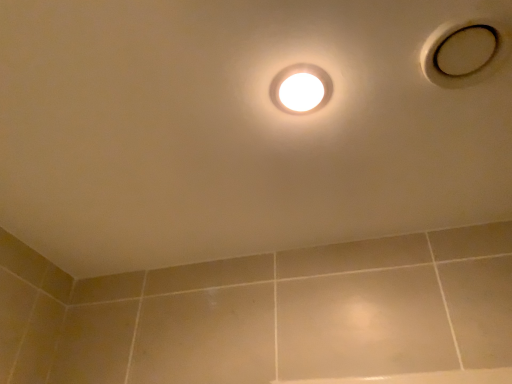
Question: Is white matte hole at upper right taller or shorter than white glossy droplight at center?

Choices:
 (A) short
 (B) tall

Answer: (B)

Question: In the image, is white matte hole at upper right positioned in front of or behind white glossy droplight at center?

Choices:
 (A) front
 (B) behind

Answer: (A)

Question: Considering the positions of white matte hole at upper right and white glossy droplight at center in the image, is white matte hole at upper right bigger or smaller than white glossy droplight at center?

Choices:
 (A) small
 (B) big

Answer: (B)

Question: Considering their positions, is white glossy droplight at center located in front of or behind white matte hole at upper right?

Choices:
 (A) front
 (B) behind

Answer: (B)

Question: Is white glossy droplight at center taller or shorter than white matte hole at upper right?

Choices:
 (A) tall
 (B) short

Answer: (B)

Question: From the image's perspective, is white glossy droplight at center positioned above or below white matte hole at upper right?

Choices:
 (A) above
 (B) below

Answer: (B)

Question: Is white glossy droplight at center wider or thinner than white matte hole at upper right?

Choices:
 (A) thin
 (B) wide

Answer: (A)